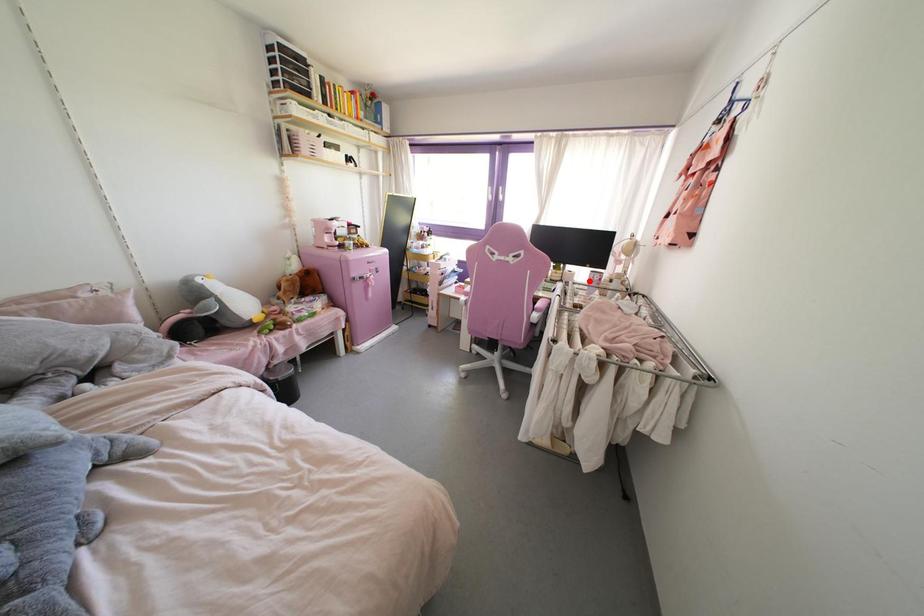
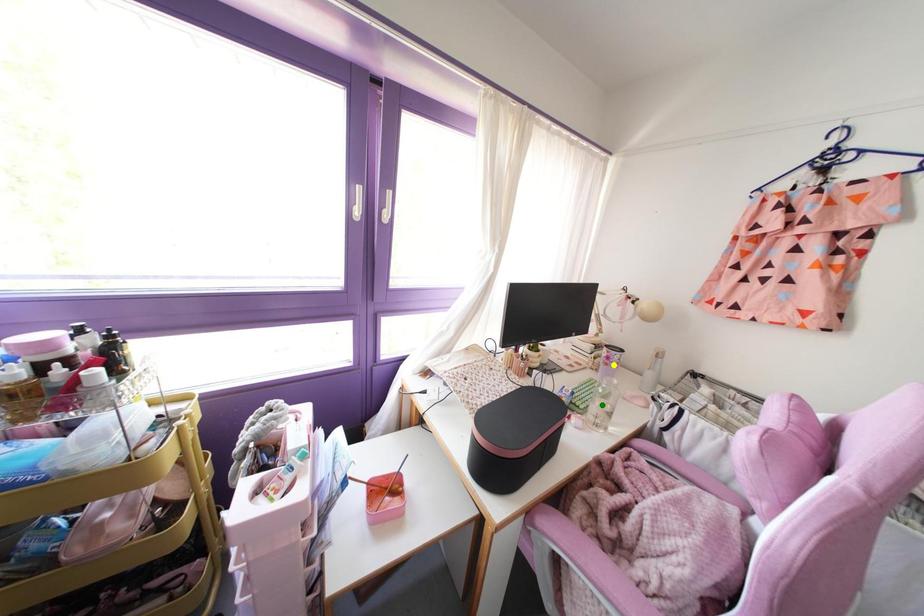
Question: I am providing you with two images of the same scene from different viewpoints. A red point is marked on the first image. You are given multiple points on the second image. Which point in image 2 is actually the same real-world point as the red point in image 1?

Choices:
 (A) blue point
 (B) yellow point
 (C) green point

Answer: (B)